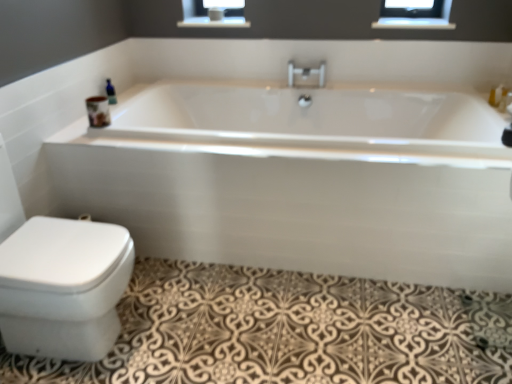
Question: In the image, is blue glass bottle at upper left on the left side or the right side of white glossy bathtub at center?

Choices:
 (A) right
 (B) left

Answer: (B)

Question: Considering the positions of blue glass bottle at upper left and white glossy bathtub at center in the image, is blue glass bottle at upper left taller or shorter than white glossy bathtub at center?

Choices:
 (A) short
 (B) tall

Answer: (A)

Question: Based on their relative distances, which object is nearer to the clear glass balustrade at upper center?

Choices:
 (A) polished chrome faucet at center
 (B) brown textured bath mat at lower left
 (C) blue glass bottle at upper left
 (D) white glossy bidet at lower left
 (E) white glossy bathtub at center

Answer: (A)

Question: Which of these objects is positioned closest to the polished chrome faucet at center?

Choices:
 (A) brown textured bath mat at lower left
 (B) white glossy bidet at lower left
 (C) white glossy bathtub at center
 (D) blue glass bottle at upper left
 (E) clear glass balustrade at upper center

Answer: (E)